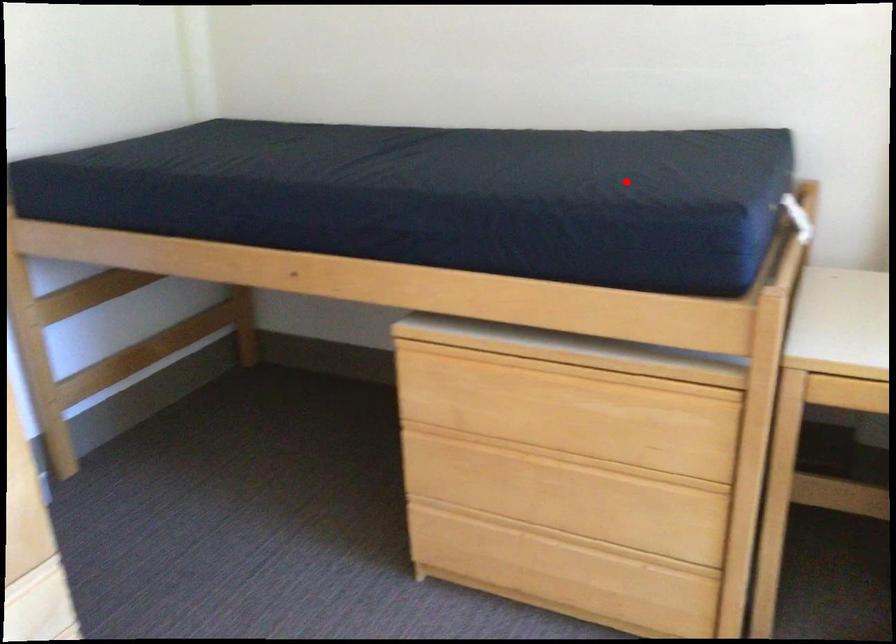
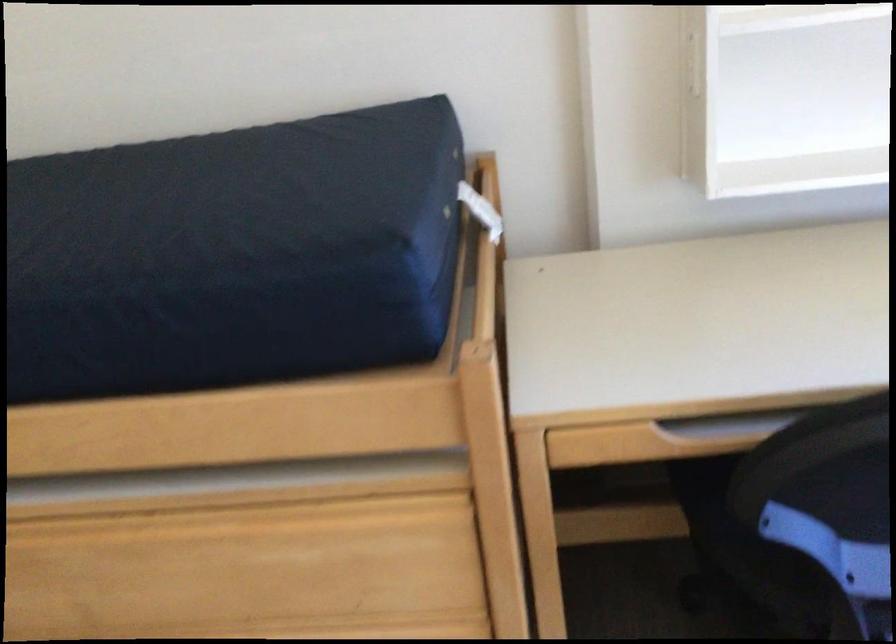
Locate, in the second image, the point that corresponds to the highlighted location in the first image.

(243, 221)